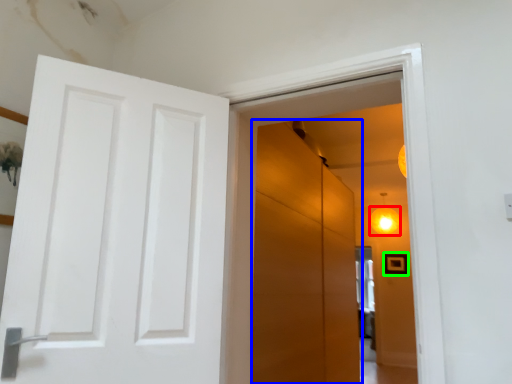
Question: Estimate the real-world distances between objects in this image. Which object is farther from lighting (highlighted by a red box), screen door (highlighted by a blue box) or picture frame (highlighted by a green box)?

Choices:
 (A) screen door
 (B) picture frame

Answer: (A)